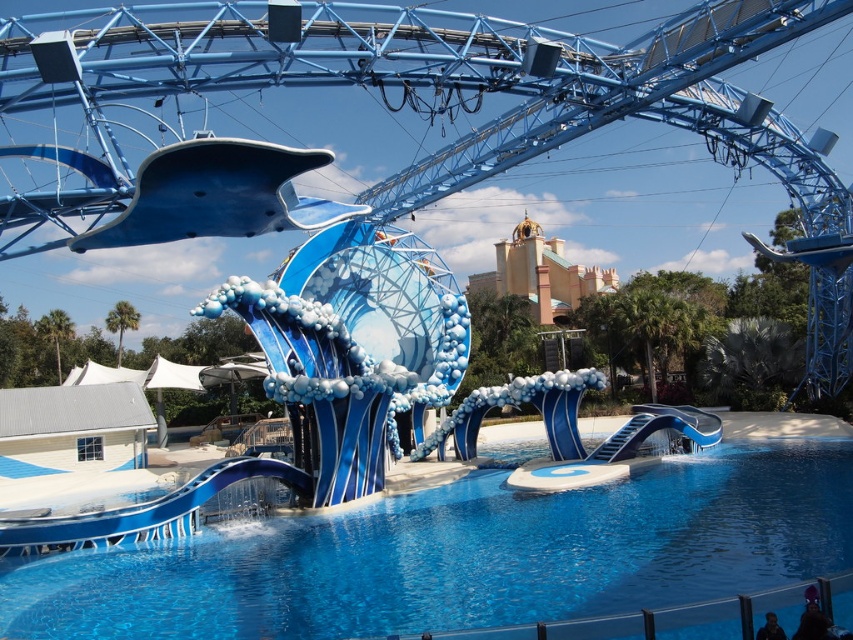
Question: Which object is closer to the camera taking this photo?

Choices:
 (A) glossy plastic slide at lower left
 (B) transparent glass pool at center
 (C) glossy blue whale at upper center

Answer: (B)

Question: Among these objects, which one is nearest to the camera?

Choices:
 (A) transparent glass pool at center
 (B) glossy plastic slide at lower left

Answer: (A)

Question: Is glossy blue whale at upper center to the left of glossy plastic slide at lower left from the viewer's perspective?

Choices:
 (A) no
 (B) yes

Answer: (A)

Question: Does glossy blue whale at upper center have a smaller size compared to glossy plastic slide at lower left?

Choices:
 (A) yes
 (B) no

Answer: (B)

Question: Can you confirm if transparent glass pool at center is bigger than glossy blue whale at upper center?

Choices:
 (A) yes
 (B) no

Answer: (A)

Question: Which of the following is the farthest from the observer?

Choices:
 (A) transparent glass pool at center
 (B) glossy blue whale at upper center
 (C) glossy plastic slide at lower left

Answer: (C)